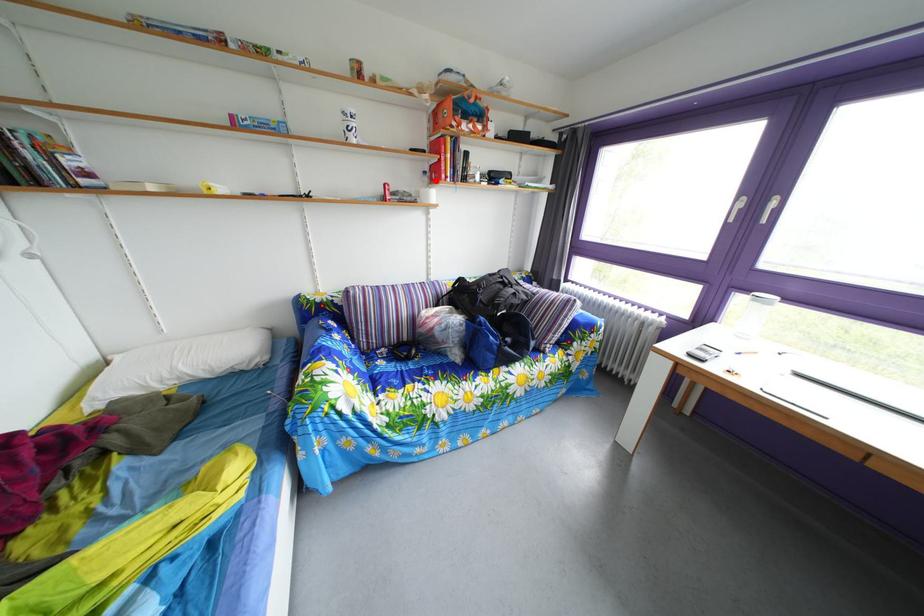
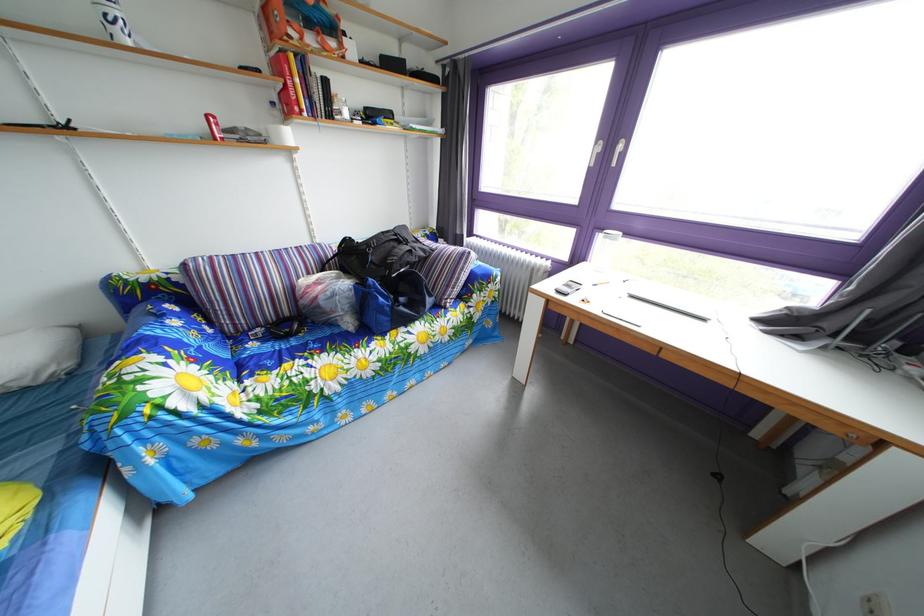
In the second image, find the point that corresponds to the highlighted location in the first image.

(284, 111)